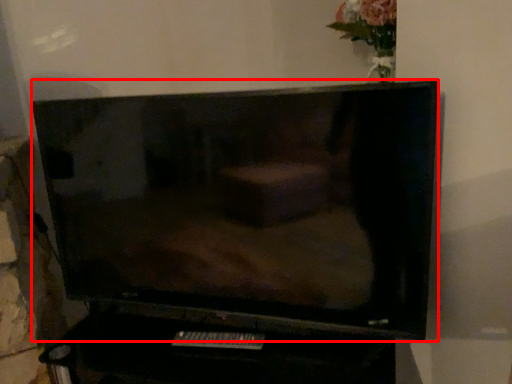
Question: From the image, what is the correct spatial relationship of television (annotated by the red box) in relation to remote?

Choices:
 (A) left
 (B) right

Answer: (A)